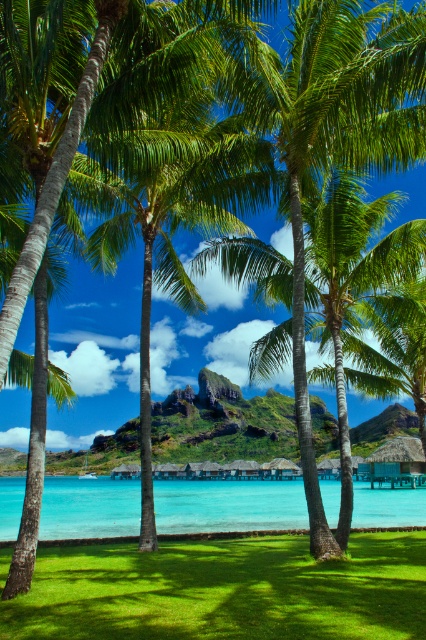
You are planning to set up a small tent for a picnic. You have two options for the location based on the image description. The first option is on the green grass at lower left, and the second is near the clear blue water at center. Considering the spatial details provided, which location would be more suitable for setting up the tent?

The green grass at lower left is thinner than the clear blue water at center, so the clear blue water at center is not suitable for setting up a tent. The green grass at lower left, despite being thinner, is still a better option for setting up the tent as it provides a solid ground compared to water.

You are standing on the green grass at lower left and want to reach the clear blue water at center. Which direction should you move to get there?

Since the green grass at lower left is located above the clear blue water at center, you should move downward towards the clear blue water at center to reach it.

You are standing on the resort island and want to take a photo of both the green grass at lower left and the clear blue water at center. Which object should you focus on first to ensure both are in sharp focus?

The green grass at lower left is closer to the viewer than the clear blue water at center. To ensure both are in sharp focus, you should focus on the green grass at lower left first, as it is the closer object.